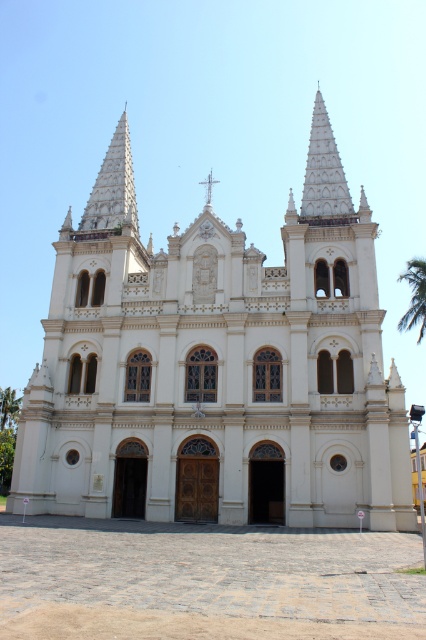
Is white stone church at center smaller than white stone cross at center?

Incorrect, white stone church at center is not smaller in size than white stone cross at center.

Describe the element at coordinates (216, 380) in the screenshot. I see `white stone church at center` at that location.

Who is more forward, (28,381) or (209,177)?

Positioned in front is point (209,177).

Identify the location of white stone church at center. (216, 380).

Which is behind, point (342, 170) or point (204, 205)?

Positioned behind is point (342, 170).

This screenshot has height=640, width=426. I want to click on white stucco spire at upper center, so click(x=324, y=170).

I want to click on white stucco spire at upper center, so click(x=324, y=170).

Does white stone spire at upper left appear under white stone cross at center?

No, white stone spire at upper left is not below white stone cross at center.

The image size is (426, 640). Describe the element at coordinates (112, 186) in the screenshot. I see `white stone spire at upper left` at that location.

At what (x,y) coordinates should I click in order to perform the action: click on white stone spire at upper left. Please return your answer as a coordinate pair (x, y). This screenshot has height=640, width=426. Looking at the image, I should click on (112, 186).